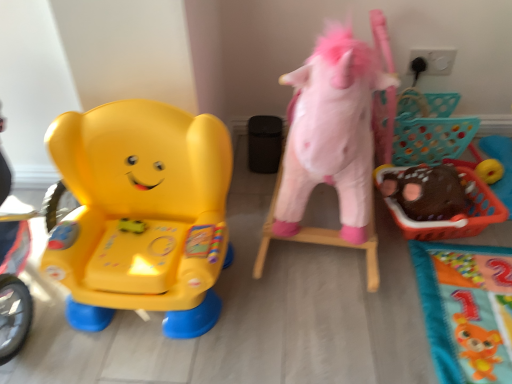
What are the coordinates of `free space in front of fluffy pink unicorn at right, which is the 2th toy from left to right` in the screenshot? It's located at (371, 308).